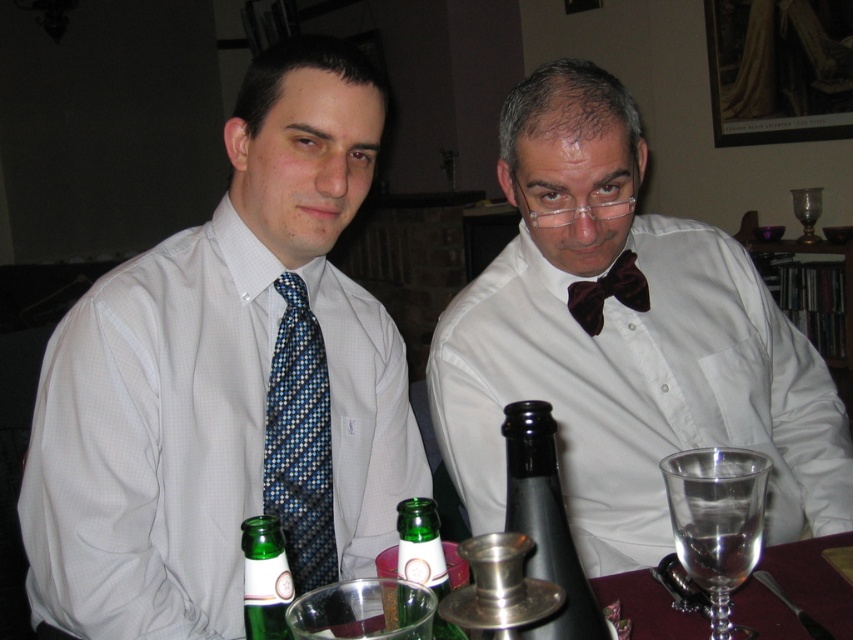
You are a waiter in a restaurant and need to reach for a green glass bottle. Which one is closer to you, the green glass bottle at lower left or the green glass bottle at center?

The green glass bottle at lower left is closer to you because it is further to the viewer than the green glass bottle at center, meaning it is nearer in proximity.

You are a waiter in a restaurant and need to place a new drink order between the matte black bow tie at center and the green glass bottle at center. Which side should you place it on to maintain the current arrangement?

The matte black bow tie at center is on the right side of the green glass bottle at center, so you should place the new drink order to the right of the green glass bottle at center but to the left of the matte black bow tie at center to maintain the current arrangement.